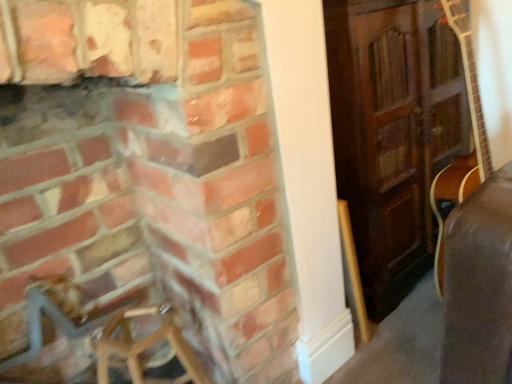
Question: From a real-world perspective, is wooden armchair at lower left over brick fireplace at left?

Choices:
 (A) no
 (B) yes

Answer: (A)

Question: From the image's perspective, is wooden armchair at lower left located beneath brick fireplace at left?

Choices:
 (A) yes
 (B) no

Answer: (A)

Question: From a real-world perspective, is wooden armchair at lower left located beneath brick fireplace at left?

Choices:
 (A) yes
 (B) no

Answer: (A)

Question: Is the position of wooden armchair at lower left more distant than that of brick fireplace at left?

Choices:
 (A) yes
 (B) no

Answer: (A)

Question: Considering the relative positions of wooden armchair at lower left and brick fireplace at left in the image provided, is wooden armchair at lower left in front of brick fireplace at left?

Choices:
 (A) no
 (B) yes

Answer: (A)

Question: Is the surface of wooden armchair at lower left in direct contact with brick fireplace at left?

Choices:
 (A) yes
 (B) no

Answer: (B)

Question: From the image's perspective, is brick fireplace at left beneath wooden armchair at lower left?

Choices:
 (A) no
 (B) yes

Answer: (A)

Question: Does brick fireplace at left have a larger size compared to wooden armchair at lower left?

Choices:
 (A) yes
 (B) no

Answer: (A)

Question: Can you see brick fireplace at left touching wooden armchair at lower left?

Choices:
 (A) no
 (B) yes

Answer: (A)

Question: Would you consider brick fireplace at left to be distant from wooden armchair at lower left?

Choices:
 (A) yes
 (B) no

Answer: (B)

Question: Considering the relative sizes of brick fireplace at left and wooden armchair at lower left in the image provided, is brick fireplace at left wider than wooden armchair at lower left?

Choices:
 (A) yes
 (B) no

Answer: (A)

Question: Is brick fireplace at left at the left side of wooden armchair at lower left?

Choices:
 (A) no
 (B) yes

Answer: (A)

Question: Would you say brick fireplace at left is to the left or to the right of wooden armchair at lower left in the picture?

Choices:
 (A) left
 (B) right

Answer: (B)